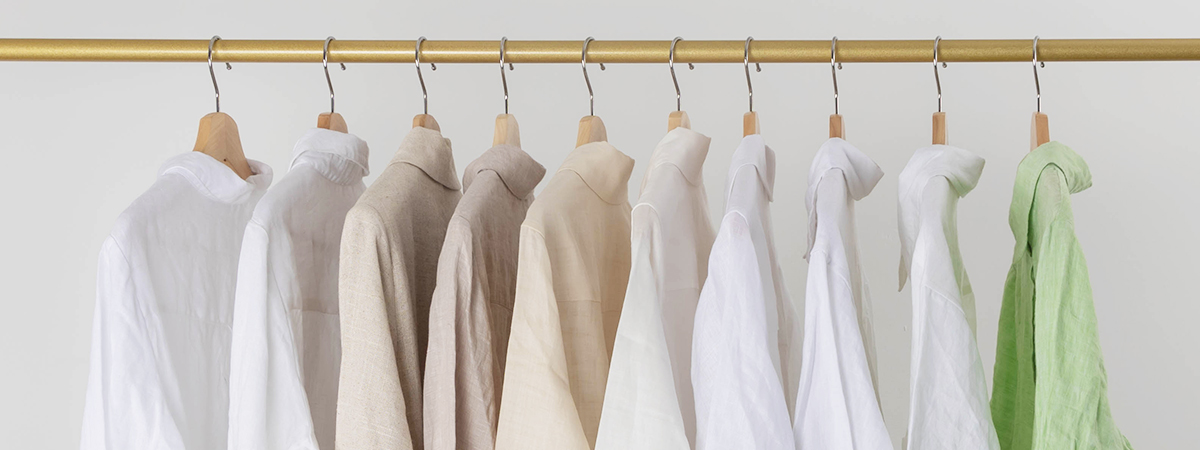
At what (x,y) coordinates should I click in order to perform the action: click on clothes hangers. Please return your answer as a coordinate pair (x, y). Looking at the image, I should click on (218, 135), (324, 118), (420, 121), (502, 134), (586, 129), (679, 121), (750, 130), (834, 129), (937, 121), (1038, 122).